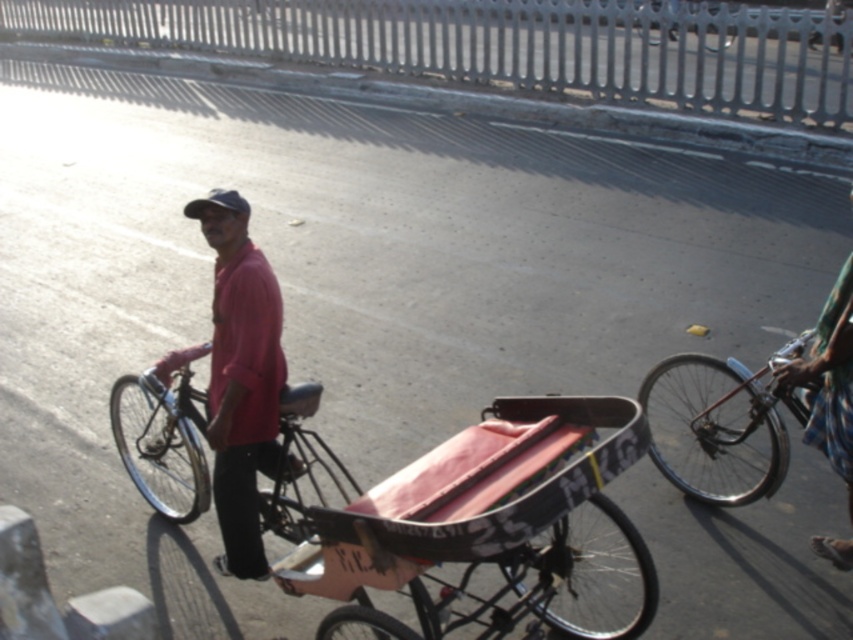
You are standing at the point marked as point (830, 380) in the image. What is the color and pattern of the clothing item you are standing on?

The point (830, 380) is on a green plaid shirt at right.

You are a photographer standing at the center of the street. You want to take a photo of the pink matte shirt at center and the metallic silver bicycle at center. Which object should you focus on first if you want to capture both in the same frame without moving the camera?

The pink matte shirt at center is not as tall as metallic silver bicycle at center, so you should focus on the metallic silver bicycle at center first because it is taller and will require adjusting the camera angle to include both in the frame.

You are a photographer trying to capture both the pink matte shirt at center and the metallic silver bicycle at center in a single frame. Given their sizes, which object should you focus on to ensure both are visible without cropping?

Since the pink matte shirt at center occupies less space than the metallic silver bicycle at center, you should focus on the pink matte shirt at center to ensure both objects fit in the frame without cropping.